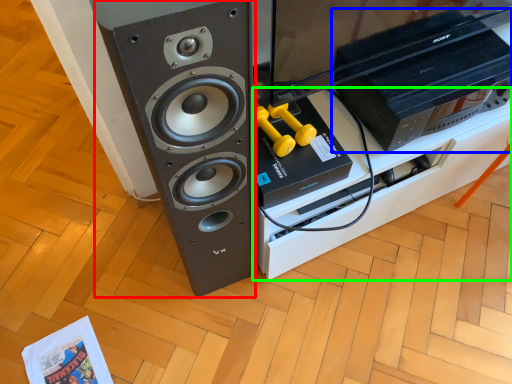
Question: Which object is positioned closest to speaker (highlighted by a red box)? Select from home appliance (highlighted by a blue box) and furniture (highlighted by a green box).

Choices:
 (A) home appliance
 (B) furniture

Answer: (B)